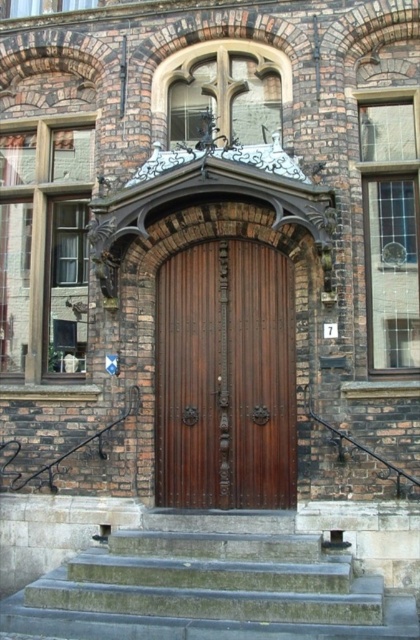
Looking at this image, you are a delivery person carrying a heavy package and need to enter the building. The gray stone stairs at center and the polished wood door at center are in your path. Considering the height difference, which obstacle would be harder for you to navigate?

The gray stone stairs at center has a greater height compared to the polished wood door at center, so the stairs would be harder to navigate due to their increased height.

You are a delivery person with a large package that requires a flat surface to place. You see the gray stone stairs at center and the polished wood door at center. Which one can you place your package on?

The gray stone stairs at center is larger in size than polished wood door at center, so you can place your package on the gray stone stairs at center.